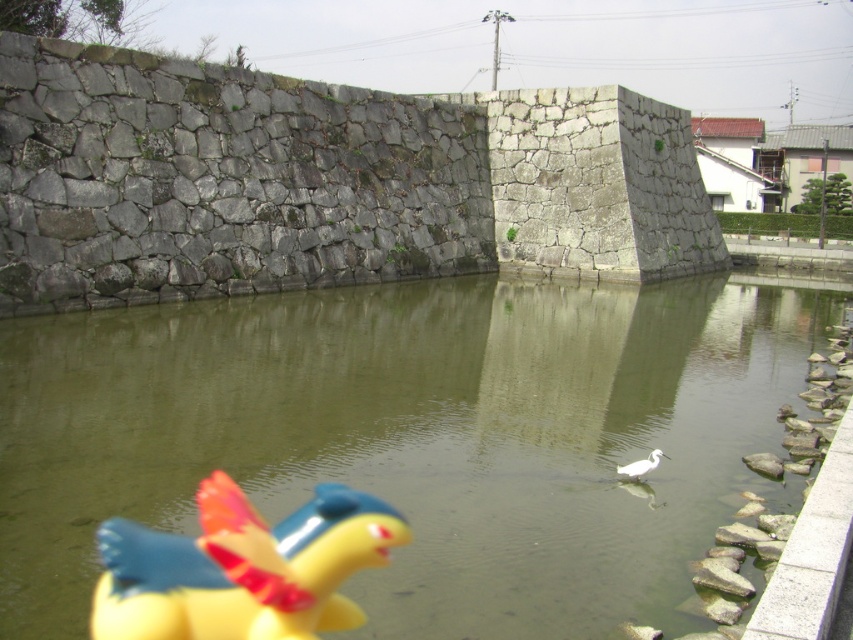
Question: Can you confirm if greenish water at center is positioned below white matte bird at center?

Choices:
 (A) yes
 (B) no

Answer: (B)

Question: Which object appears farthest from the camera in this image?

Choices:
 (A) yellow rubber duck at lower left
 (B) white matte bird at center
 (C) greenish water at center

Answer: (B)

Question: Does greenish water at center have a larger size compared to yellow rubber duck at lower left?

Choices:
 (A) no
 (B) yes

Answer: (B)

Question: Which object is positioned farthest from the white matte bird at center?

Choices:
 (A) greenish water at center
 (B) yellow rubber duck at lower left

Answer: (A)

Question: Is greenish water at center smaller than white matte bird at center?

Choices:
 (A) yes
 (B) no

Answer: (B)

Question: Which point appears farthest from the camera in this image?

Choices:
 (A) (650, 468)
 (B) (376, 547)

Answer: (A)